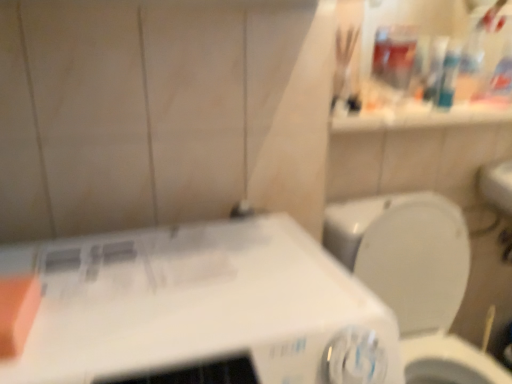
Question: Is white plastic washing machine at lower left inside or outside of orange matte soap at left?

Choices:
 (A) inside
 (B) outside

Answer: (B)

Question: Considering the positions of white plastic washing machine at lower left and orange matte soap at left in the image, is white plastic washing machine at lower left taller or shorter than orange matte soap at left?

Choices:
 (A) tall
 (B) short

Answer: (A)

Question: Which object is positioned farthest from the orange matte soap at left?

Choices:
 (A) white glossy toilet at right
 (B) white plastic washing machine at lower left

Answer: (A)

Question: Which of these objects is positioned closest to the orange matte soap at left?

Choices:
 (A) white plastic washing machine at lower left
 (B) white glossy toilet at right

Answer: (A)